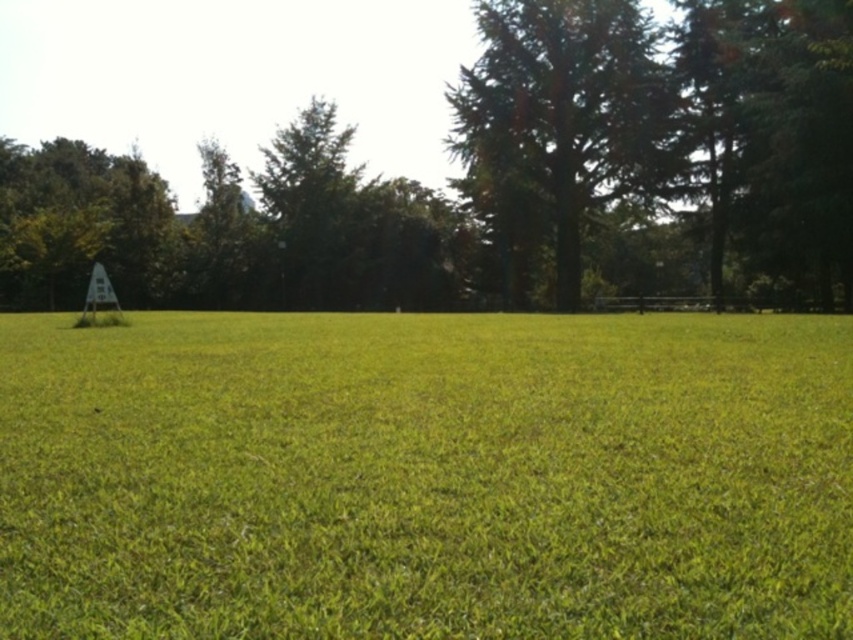
You are planning to plant a new flower bed in the green grass at center and want to ensure it doesn not interfere with the green leafy tree at center. Based on the scene, which area has more space available for planting?

The green leafy tree at center occupies more space than the green grass at center, so the flower bed should be placed around the green grass at center where there is more available space.

Looking at this image, you are standing at point (497, 179) in the image. What object is located exactly at your current position?

The green leafy tree at center is located exactly at point (497, 179).

You are standing on the green grass at center and want to look up to see the green leafy tree at center. Is the tree above or below you?

The green grass at center is located below green leafy tree at center, so the tree is above you.